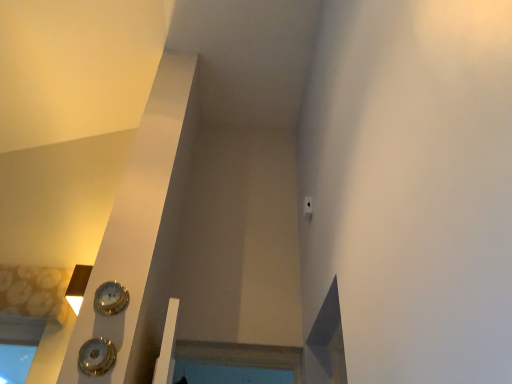
Question: From a real-world perspective, is shiny silver clock at lower left, which is the first clock in front-to-back order, positioned above or below gold metallic clock at lower left, acting as the 1th clock starting from the back?

Choices:
 (A) above
 (B) below

Answer: (B)

Question: Is shiny silver clock at lower left, the 2th clock from the back, taller or shorter than gold metallic clock at lower left, the second clock when ordered from front to back?

Choices:
 (A) tall
 (B) short

Answer: (A)

Question: Considering the positions of point (91, 367) and point (96, 289), is point (91, 367) closer or farther from the camera than point (96, 289)?

Choices:
 (A) farther
 (B) closer

Answer: (B)

Question: From a real-world perspective, relative to shiny silver clock at lower left, which is the first clock from bottom to top, is gold metallic clock at lower left, the 2th clock when ordered from bottom to top, vertically above or below?

Choices:
 (A) below
 (B) above

Answer: (B)

Question: From the image's perspective, is gold metallic clock at lower left, acting as the 1th clock starting from the back, positioned above or below shiny silver clock at lower left, which is the first clock in front-to-back order?

Choices:
 (A) below
 (B) above

Answer: (B)

Question: Based on their positions, is gold metallic clock at lower left, acting as the 1th clock starting from the back, located to the left or right of shiny silver clock at lower left, placed as the second clock when sorted from top to bottom?

Choices:
 (A) left
 (B) right

Answer: (B)

Question: Is gold metallic clock at lower left, the 2th clock when ordered from bottom to top, inside the boundaries of shiny silver clock at lower left, placed as the second clock when sorted from top to bottom, or outside?

Choices:
 (A) inside
 (B) outside

Answer: (B)